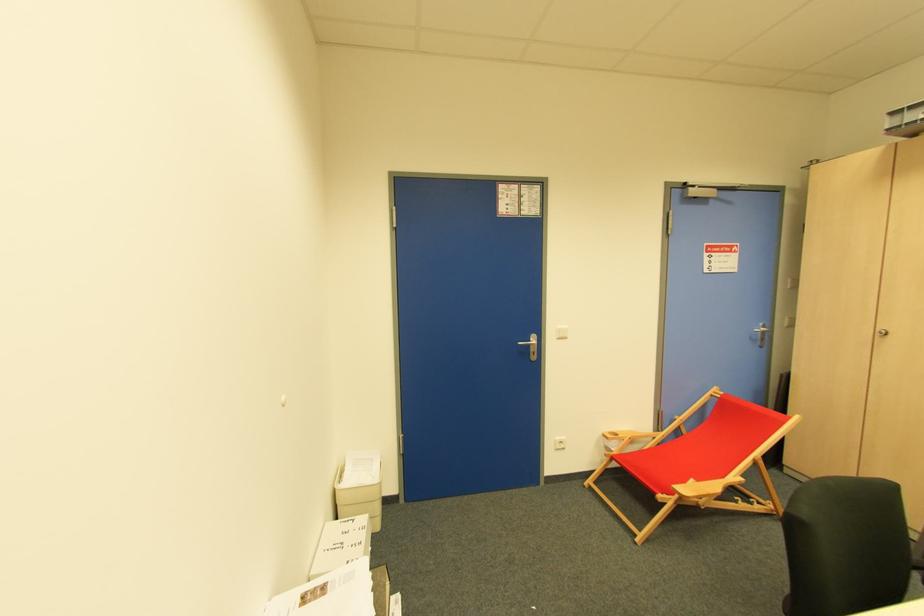
Describe the element at coordinates (703, 488) in the screenshot. Image resolution: width=924 pixels, height=616 pixels. I see `the wooden chair armrest` at that location.